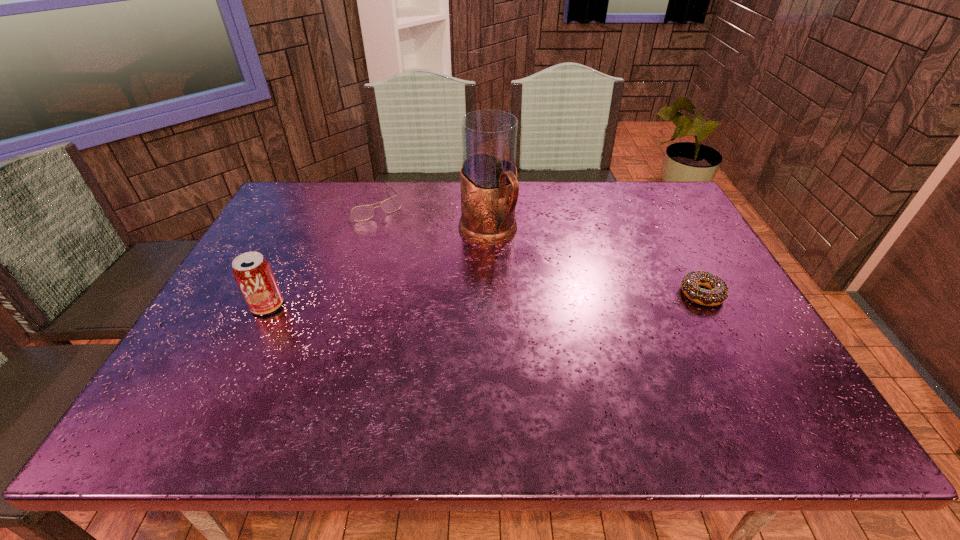
Locate an element on the screen. blank area located with the handle on the side of the tallest object is located at coordinates (556, 316).

Find the location of `free space located 0.090m with the handle on the side of the tallest object`. free space located 0.090m with the handle on the side of the tallest object is located at coordinates [518, 272].

The width and height of the screenshot is (960, 540). What are the coordinates of `vacant space located 0.320m with the handle on the side of the tallest object` in the screenshot? It's located at (568, 330).

In order to click on vacant space situated on the front-facing side of the second shortest object in this screenshot , I will do `click(423, 275)`.

This screenshot has width=960, height=540. I want to click on vacant region located on the front-facing side of the second shortest object, so click(x=417, y=267).

You are a GUI agent. You are given a task and a screenshot of the screen. Output one action in this format:
    pyautogui.click(x=<x>, y=<y>)
    Task: Click on the free region located 0.380m on the front-facing side of the second shortest object
    
    Given the screenshot: What is the action you would take?
    pyautogui.click(x=436, y=293)

Find the location of `pitcher present at the far edge`. pitcher present at the far edge is located at coordinates click(488, 177).

Identify the location of spectacles that is at the far edge. (x=360, y=213).

Where is `object that is at the left edge`? object that is at the left edge is located at coordinates (253, 274).

Where is `object that is at the right edge`? This screenshot has width=960, height=540. object that is at the right edge is located at coordinates point(690,283).